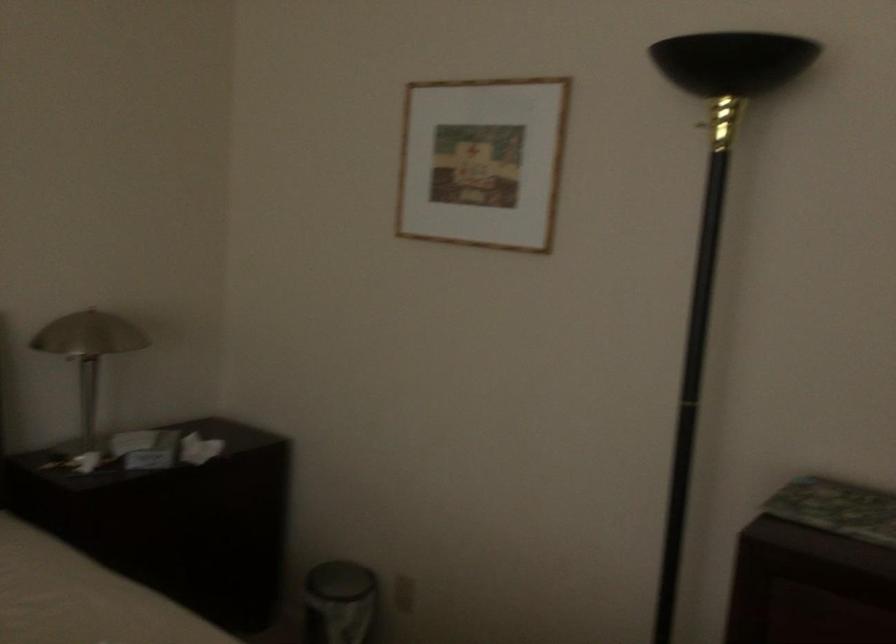
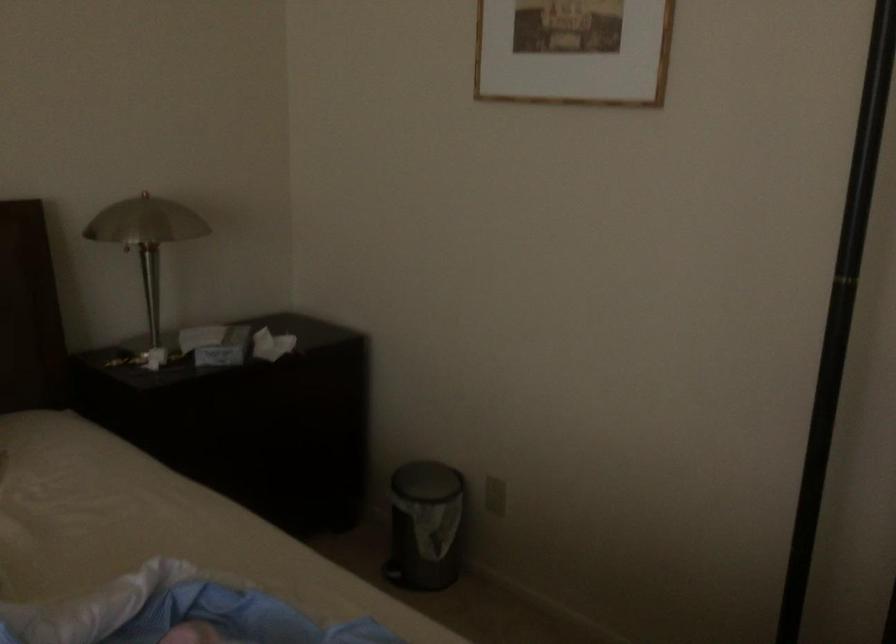
In the second image, find the point that corresponds to (201,450) in the first image.

(271, 345)